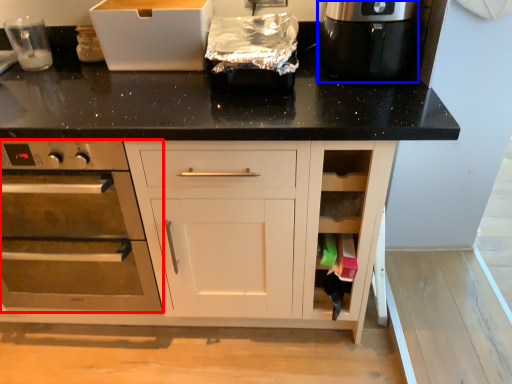
Question: Which object appears closest to the camera in this image, home appliance (highlighted by a red box) or kitchen appliance (highlighted by a blue box)?

Choices:
 (A) home appliance
 (B) kitchen appliance

Answer: (A)